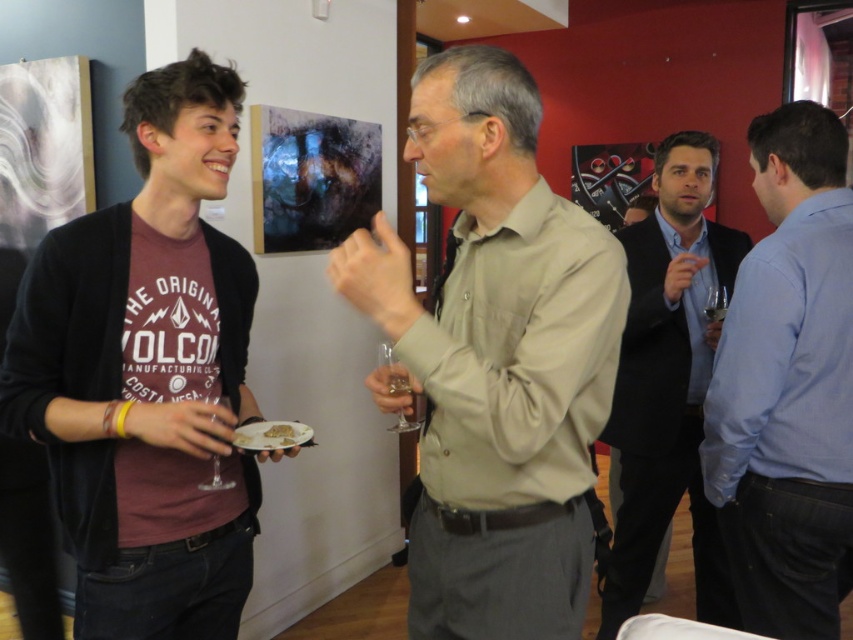
Is blue shirt at right further to camera compared to white creamy cake at center?

Yes, it is behind white creamy cake at center.

Describe the element at coordinates (788, 387) in the screenshot. The width and height of the screenshot is (853, 640). I see `blue shirt at right` at that location.

Where is `blue shirt at right`? The height and width of the screenshot is (640, 853). blue shirt at right is located at coordinates (788, 387).

Can you confirm if blue shirt at right is positioned to the right of white matte plate at lower center?

Indeed, blue shirt at right is positioned on the right side of white matte plate at lower center.

Is blue shirt at right to the left of white matte plate at lower center from the viewer's perspective?

In fact, blue shirt at right is to the right of white matte plate at lower center.

Describe the element at coordinates (788, 387) in the screenshot. The image size is (853, 640). I see `blue shirt at right` at that location.

Identify the location of blue shirt at right. The image size is (853, 640). (788, 387).

Between maroon cotton t-shirt at left and white creamy cake at center, which one has less height?

white creamy cake at center

Who is more forward, [241,529] or [285,428]?

Point [285,428] is more forward.

Who is more distant from viewer, (148, 518) or (286, 424)?

The point (286, 424) is behind.

The image size is (853, 640). I want to click on maroon cotton t-shirt at left, so click(148, 374).